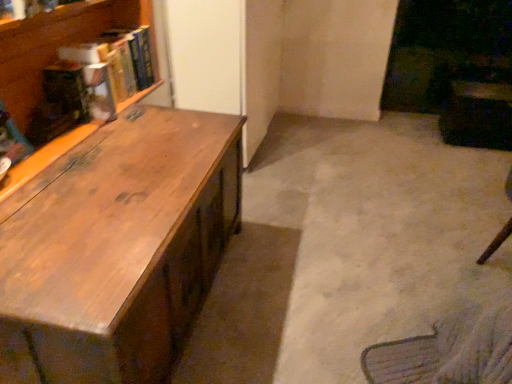
Locate an element on the screen. hardcover book at upper left, which is counted as the second book, starting from the front is located at coordinates (129, 60).

Considering the sizes of objects hardcover book at upper left, the 1th book in the front-to-back sequence, and hardcover book at upper left, which is the first book in back-to-front order, in the image provided, who is taller, hardcover book at upper left, the 1th book in the front-to-back sequence, or hardcover book at upper left, which is the first book in back-to-front order,?

hardcover book at upper left, which is the first book in back-to-front order, is taller.

From a real-world perspective, between hardcover book at upper left, the 1th book in the front-to-back sequence, and hardcover book at upper left, which is the first book in back-to-front order, who is vertically lower?

hardcover book at upper left, the 1th book in the front-to-back sequence, is physically lower.

Identify the location of book lying on the left of hardcover book at upper left, which is the first book in back-to-front order. The image size is (512, 384). (101, 73).

Would you consider hardcover book at upper left, the 1th book in the front-to-back sequence, to be distant from hardcover book at upper left, which is the first book in back-to-front order?

hardcover book at upper left, the 1th book in the front-to-back sequence, is near hardcover book at upper left, which is the first book in back-to-front order, not far away.

Is point (61, 247) positioned in front of point (147, 45)?

Yes, point (61, 247) is in front of point (147, 45).

Is wooden desk at left to the left or to the right of hardcover book at upper left, which is counted as the second book, starting from the front, in the image?

From the image, it's evident that wooden desk at left is to the right of hardcover book at upper left, which is counted as the second book, starting from the front.

This screenshot has width=512, height=384. Identify the location of desk on the right of hardcover book at upper left, which is the first book in back-to-front order. pyautogui.click(x=117, y=248).

From a real-world perspective, is wooden desk at left physically below hardcover book at upper left, which is counted as the second book, starting from the front?

Yes, from a real-world perspective, wooden desk at left is beneath hardcover book at upper left, which is counted as the second book, starting from the front.

Who is taller, hardcover book at upper left, which is counted as the second book, starting from the front, or hardcover book at upper left, which is the 2th book in back-to-front order?

Standing taller between the two is hardcover book at upper left, which is counted as the second book, starting from the front.

Is hardcover book at upper left, which is counted as the second book, starting from the front, behind hardcover book at upper left, the 1th book in the front-to-back sequence?

Yes, hardcover book at upper left, which is counted as the second book, starting from the front, is further from the camera.

From a real-world perspective, is hardcover book at upper left, which is counted as the second book, starting from the front, physically located above or below hardcover book at upper left, the 1th book in the front-to-back sequence?

hardcover book at upper left, which is counted as the second book, starting from the front, is above hardcover book at upper left, the 1th book in the front-to-back sequence.

Is hardcover book at upper left, which is counted as the second book, starting from the front, positioned beyond the bounds of hardcover book at upper left, which is the 2th book in back-to-front order?

hardcover book at upper left, which is counted as the second book, starting from the front, lies outside hardcover book at upper left, which is the 2th book in back-to-front order,'s area.

Where is `desk that appears in front of the hardcover book at upper left, which is the 2th book in back-to-front order`? Image resolution: width=512 pixels, height=384 pixels. desk that appears in front of the hardcover book at upper left, which is the 2th book in back-to-front order is located at coordinates (117, 248).

Is hardcover book at upper left, the 1th book in the front-to-back sequence, next to wooden desk at left?

No.

Between point (80, 67) and point (195, 149), which one is positioned behind?

Point (80, 67)

Considering the relative sizes of hardcover book at upper left, the 1th book in the front-to-back sequence, and wooden desk at left in the image provided, is hardcover book at upper left, the 1th book in the front-to-back sequence, bigger than wooden desk at left?

No.

Does point (117, 57) lie behind point (105, 352)?

Yes, point (117, 57) is behind point (105, 352).

From the image's perspective, is hardcover book at upper left, which is the first book in back-to-front order, under wooden desk at left?

Actually, hardcover book at upper left, which is the first book in back-to-front order, appears above wooden desk at left in the image.

Measure the distance from hardcover book at upper left, which is the first book in back-to-front order, to wooden desk at left.

A distance of 61.84 centimeters exists between hardcover book at upper left, which is the first book in back-to-front order, and wooden desk at left.

Which is correct: hardcover book at upper left, which is the first book in back-to-front order, is inside wooden desk at left, or outside of it?

The correct answer is: outside.

Which point is more distant from viewer, (61, 185) or (90, 90)?

The point (90, 90) is behind.

Which object is wider, wooden desk at left or hardcover book at upper left, which is the 2th book in back-to-front order?

wooden desk at left is wider.

Does wooden desk at left appear on the right side of hardcover book at upper left, the 1th book in the front-to-back sequence?

Yes, wooden desk at left is to the right of hardcover book at upper left, the 1th book in the front-to-back sequence.

Is wooden desk at left bigger than hardcover book at upper left, the 1th book in the front-to-back sequence?

Yes, wooden desk at left is bigger than hardcover book at upper left, the 1th book in the front-to-back sequence.

At what (x,y) coordinates should I click in order to perform the action: click on book on the right side of hardcover book at upper left, which is the 2th book in back-to-front order. Please return your answer as a coordinate pair (x, y). Looking at the image, I should click on (129, 60).

Locate an element on the screen. Image resolution: width=512 pixels, height=384 pixels. desk below the hardcover book at upper left, which is the first book in back-to-front order (from a real-world perspective) is located at coordinates (117, 248).

Which object lies further to the anchor point hardcover book at upper left, which is the first book in back-to-front order, hardcover book at upper left, which is the 2th book in back-to-front order, or wooden desk at left?

wooden desk at left.

Considering their positions, is hardcover book at upper left, the 1th book in the front-to-back sequence, positioned closer to wooden desk at left than hardcover book at upper left, which is the first book in back-to-front order?

hardcover book at upper left, the 1th book in the front-to-back sequence, is positioned closer to the anchor wooden desk at left.

From the image, which object appears to be nearer to hardcover book at upper left, the 1th book in the front-to-back sequence, hardcover book at upper left, which is counted as the second book, starting from the front, or wooden desk at left?

hardcover book at upper left, which is counted as the second book, starting from the front, is closer to hardcover book at upper left, the 1th book in the front-to-back sequence.

Looking at the image, which one is located closer to wooden desk at left, hardcover book at upper left, which is the first book in back-to-front order, or hardcover book at upper left, the 1th book in the front-to-back sequence?

hardcover book at upper left, the 1th book in the front-to-back sequence.

In the scene shown: Which object lies nearer to the anchor point hardcover book at upper left, which is the 2th book in back-to-front order, wooden desk at left or hardcover book at upper left, which is the first book in back-to-front order?

hardcover book at upper left, which is the first book in back-to-front order, is closer to hardcover book at upper left, which is the 2th book in back-to-front order.

Considering their positions, is wooden desk at left positioned further to hardcover book at upper left, which is counted as the second book, starting from the front, than hardcover book at upper left, the 1th book in the front-to-back sequence?

wooden desk at left is positioned further to the anchor hardcover book at upper left, which is counted as the second book, starting from the front.

This screenshot has width=512, height=384. Identify the location of book between wooden desk at left and hardcover book at upper left, which is counted as the second book, starting from the front, in the front-back direction. (101, 73).